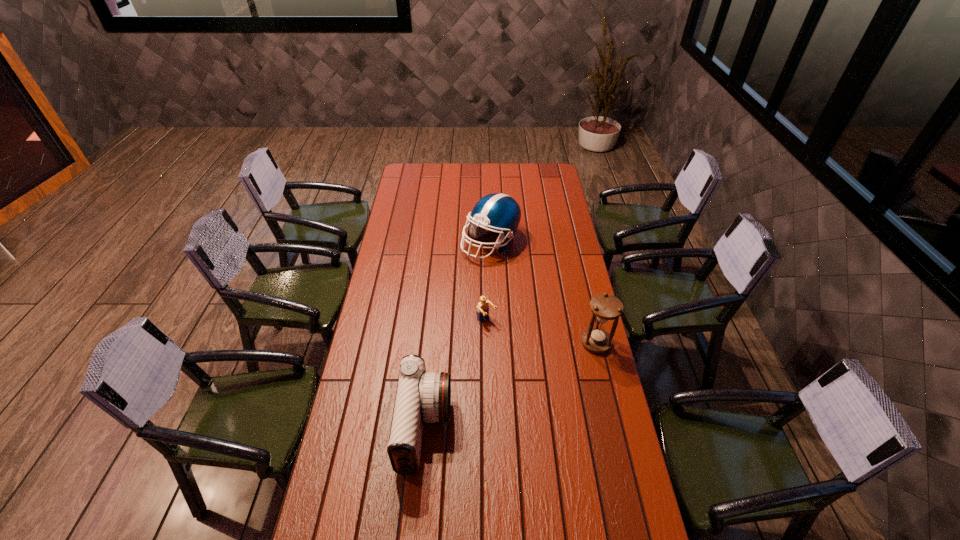
Where is `free spot between the rightmost object and the camcorder`? free spot between the rightmost object and the camcorder is located at coordinates (511, 386).

Select which object is the closest to the shortest object. Please provide its 2D coordinates. Your answer should be formatted as a tuple, i.e. [(x, y)], where the tuple contains the x and y coordinates of a point satisfying the conditions above.

[(421, 397)]

Locate which object ranks third in proximity to the football helmet. Please provide its 2D coordinates. Your answer should be formatted as a tuple, i.e. [(x, y)], where the tuple contains the x and y coordinates of a point satisfying the conditions above.

[(421, 397)]

Where is `free point that satisfies the following two spatial constraints: 1. on the back side of the farthest object; 2. on the right side of the shortest object`? free point that satisfies the following two spatial constraints: 1. on the back side of the farthest object; 2. on the right side of the shortest object is located at coordinates (486, 242).